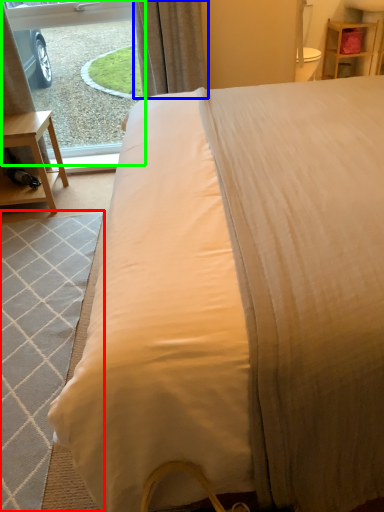
Question: Which object is the closest to the mat (highlighted by a red box)? Choose among these: curtain (highlighted by a blue box) or window screen (highlighted by a green box).

Choices:
 (A) curtain
 (B) window screen

Answer: (A)